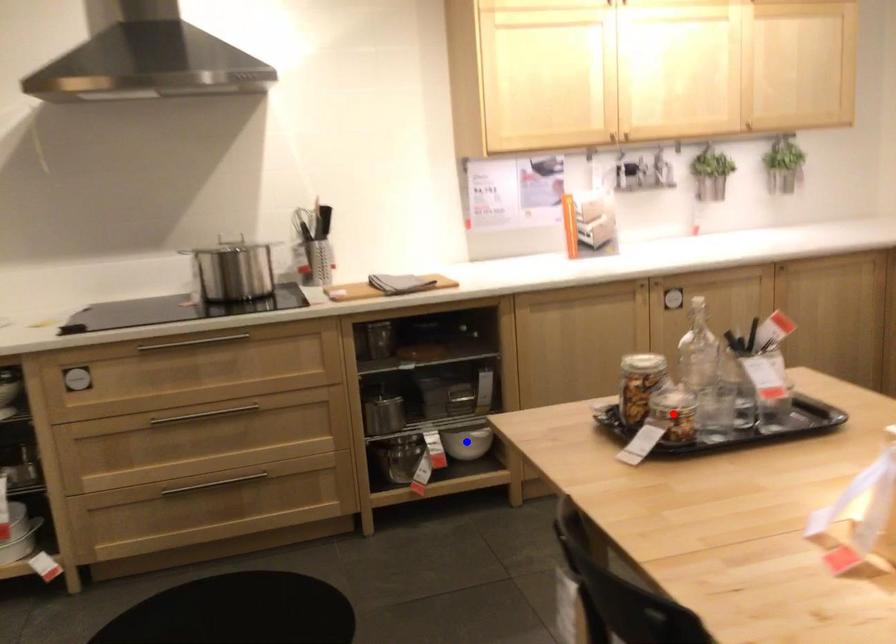
Question: Two points are marked on the image. Which point is closer to the camera?

Choices:
 (A) Blue point is closer.
 (B) Red point is closer.

Answer: (B)